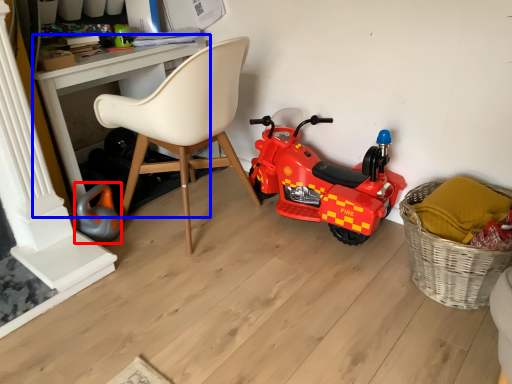
Question: Which point is further to the camera, toy (highlighted by a red box) or desk (highlighted by a blue box)?

Choices:
 (A) toy
 (B) desk

Answer: (A)